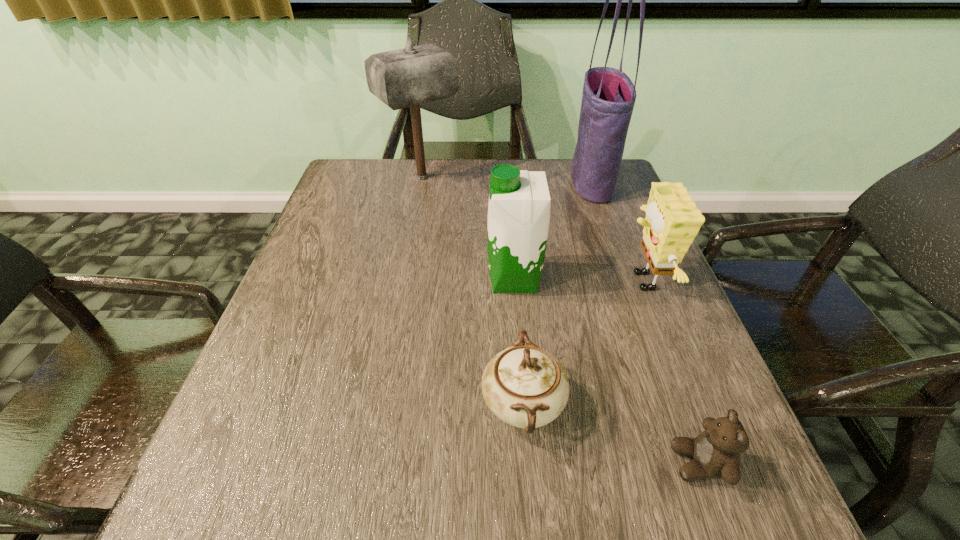
I want to click on the tallest object, so click(x=608, y=99).

Find the location of a particular element. Image resolution: width=960 pixels, height=540 pixels. the leftmost object is located at coordinates (408, 77).

In order to click on the second tallest object in this screenshot , I will do `click(408, 77)`.

The image size is (960, 540). In order to click on the third tallest object in this screenshot , I will do click(519, 204).

Locate an element on the screen. This screenshot has width=960, height=540. the fourth tallest object is located at coordinates tap(672, 221).

Locate an element on the screen. The height and width of the screenshot is (540, 960). chinaware is located at coordinates (524, 386).

Where is `the shortest object`? Image resolution: width=960 pixels, height=540 pixels. the shortest object is located at coordinates (715, 453).

Locate an element on the screen. Image resolution: width=960 pixels, height=540 pixels. free spot located 0.270m on the front of the tallest object is located at coordinates (624, 272).

I want to click on blank space located on the right of the mallet, so click(x=558, y=178).

Find the location of a particular element. This screenshot has width=960, height=540. vacant space situated 0.240m on the front-facing side of the fourth shortest object is located at coordinates (378, 279).